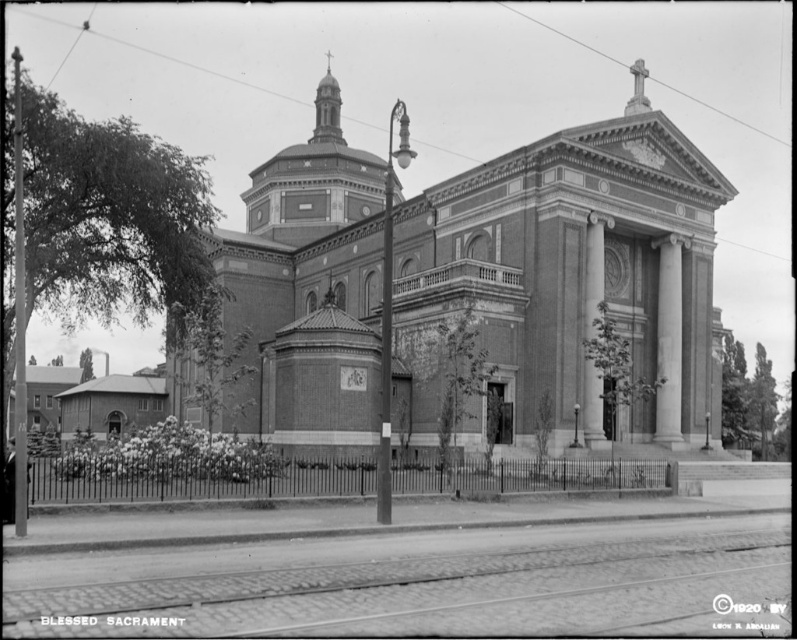
Question: Based on their relative distances, which object is nearer to the brick church at center?

Choices:
 (A) smooth stone column at center
 (B) white marble column at center

Answer: (B)

Question: In this image, where is brick church at center located relative to white marble column at center?

Choices:
 (A) left
 (B) right

Answer: (A)

Question: Which object is farther from the camera taking this photo?

Choices:
 (A) brick church at center
 (B) smooth stone column at center
 (C) white marble column at center

Answer: (C)

Question: Observing the image, what is the correct spatial positioning of brick church at center in reference to white marble column at center?

Choices:
 (A) above
 (B) below

Answer: (A)

Question: Which point is farther to the camera?

Choices:
 (A) white marble column at center
 (B) brick church at center

Answer: (A)

Question: Is brick church at center bigger than smooth stone column at center?

Choices:
 (A) no
 (B) yes

Answer: (B)